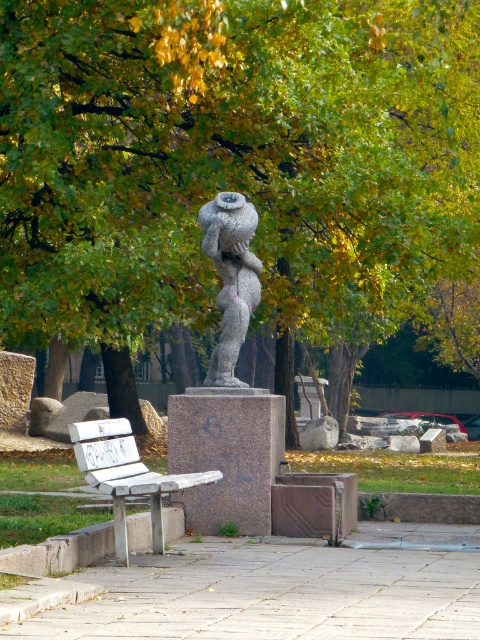
You are standing at the point closest to the sculpture. Which of the two points, point (36, 288) or point (238, 205), is farther away from you?

Point (36, 288) is behind point (238, 205), so it is farther away from you.